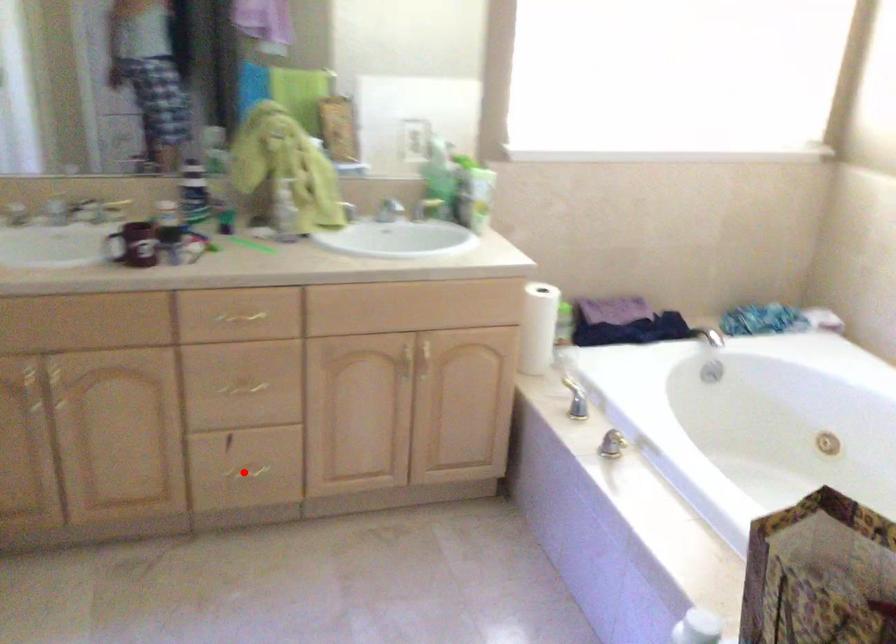
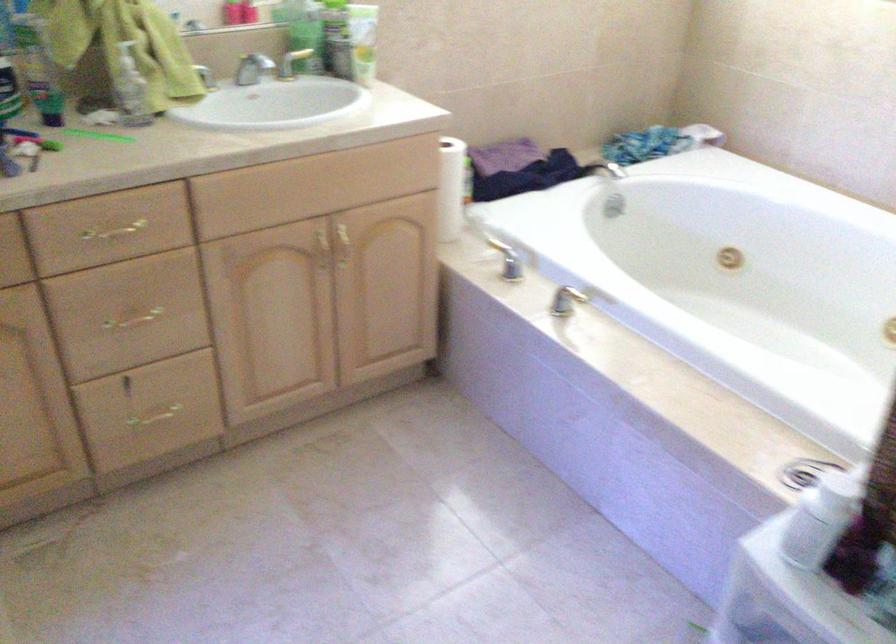
Question: I am providing you with two images of the same scene from different viewpoints. A red point is shown in image1. For the corresponding object point in image2, is it positioned nearer or farther from the camera?

Choices:
 (A) Nearer
 (B) Farther

Answer: (A)